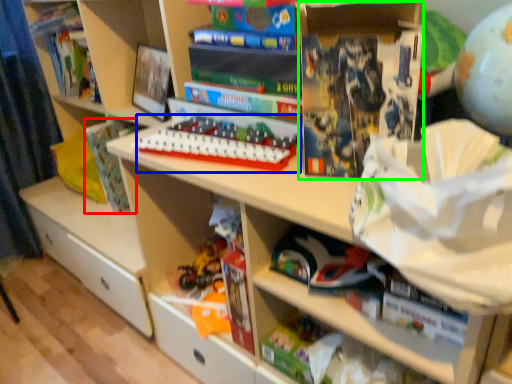
Question: Based on their relative distances, which object is nearer to paperback book (highlighted by a red box)? Choose from toy (highlighted by a blue box) and paperback book (highlighted by a green box).

Choices:
 (A) toy
 (B) paperback book

Answer: (A)